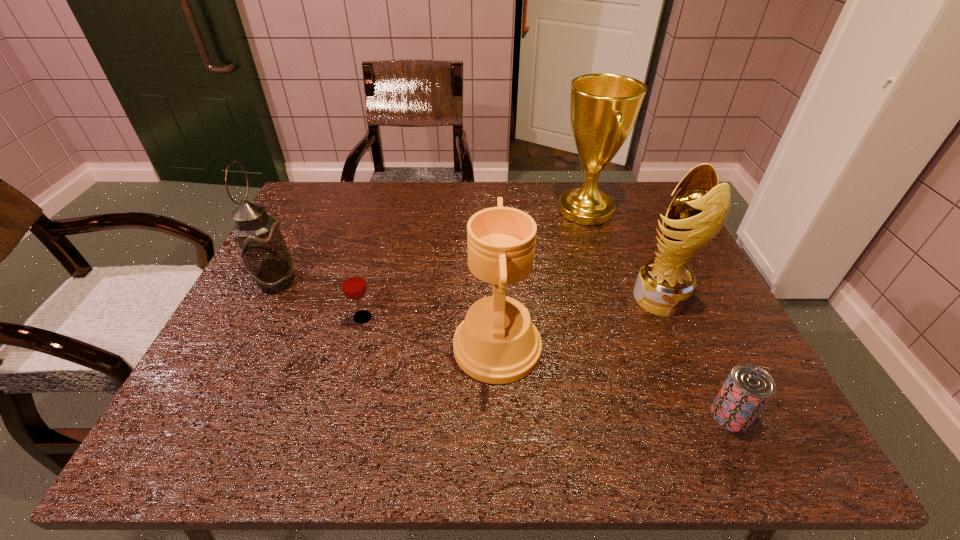
What are the coordinates of `free space located on the back of the leftmost object` in the screenshot? It's located at (322, 192).

Locate an element on the screen. The height and width of the screenshot is (540, 960). vacant region located on the front of the third object from left to right is located at coordinates (501, 444).

The width and height of the screenshot is (960, 540). What are the coordinates of `vacant space located on the back of the fifth tallest object` in the screenshot? It's located at (376, 265).

Identify the location of vacant space located on the left of the beer can. (662, 415).

The height and width of the screenshot is (540, 960). Identify the location of object positioned at the far edge. (604, 107).

Identify the location of object positioned at the near edge. (746, 391).

The height and width of the screenshot is (540, 960). Find the location of `object that is at the left edge`. object that is at the left edge is located at coordinates (264, 254).

Locate an element on the screen. beer can that is positioned at the right edge is located at coordinates (746, 391).

Locate an element on the screen. object that is at the far right corner is located at coordinates (604, 107).

You are a GUI agent. You are given a task and a screenshot of the screen. Output one action in this format:
    pyautogui.click(x=<x>, y=<y>)
    Task: Click on the object that is at the near right corner
    
    Given the screenshot: What is the action you would take?
    pyautogui.click(x=746, y=391)